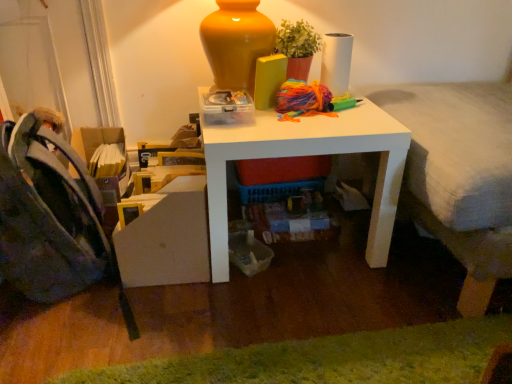
Question: From the image's perspective, would you say textured gray bed at right is positioned over white matte table at center?

Choices:
 (A) no
 (B) yes

Answer: (B)

Question: From a real-world perspective, is textured gray bed at right on top of white matte table at center?

Choices:
 (A) no
 (B) yes

Answer: (B)

Question: Is textured gray bed at right smaller than white matte table at center?

Choices:
 (A) yes
 (B) no

Answer: (B)

Question: Is textured gray bed at right to the left of white matte table at center from the viewer's perspective?

Choices:
 (A) yes
 (B) no

Answer: (B)

Question: Could you tell me if textured gray bed at right is turned towards white matte table at center?

Choices:
 (A) no
 (B) yes

Answer: (B)

Question: From a real-world perspective, relative to white matte table at center, is textured gray bed at right vertically above or below?

Choices:
 (A) above
 (B) below

Answer: (A)

Question: Is textured gray bed at right in front of or behind white matte table at center in the image?

Choices:
 (A) front
 (B) behind

Answer: (A)

Question: Is textured gray bed at right spatially inside white matte table at center, or outside of it?

Choices:
 (A) outside
 (B) inside

Answer: (A)

Question: Does point (475, 238) appear closer or farther from the camera than point (298, 145)?

Choices:
 (A) closer
 (B) farther

Answer: (A)

Question: From a real-world perspective, is white matte table at center positioned above or below green fuzzy rug at lower center?

Choices:
 (A) above
 (B) below

Answer: (A)

Question: Would you say white matte table at center is inside or outside green fuzzy rug at lower center?

Choices:
 (A) outside
 (B) inside

Answer: (A)

Question: In terms of width, does white matte table at center look wider or thinner when compared to green fuzzy rug at lower center?

Choices:
 (A) thin
 (B) wide

Answer: (B)

Question: Is white matte table at center taller or shorter than green fuzzy rug at lower center?

Choices:
 (A) short
 (B) tall

Answer: (B)

Question: Is dark blue fabric folding chair at left wider or thinner than white matte table at center?

Choices:
 (A) thin
 (B) wide

Answer: (A)

Question: Considering their positions, is dark blue fabric folding chair at left located in front of or behind white matte table at center?

Choices:
 (A) front
 (B) behind

Answer: (A)